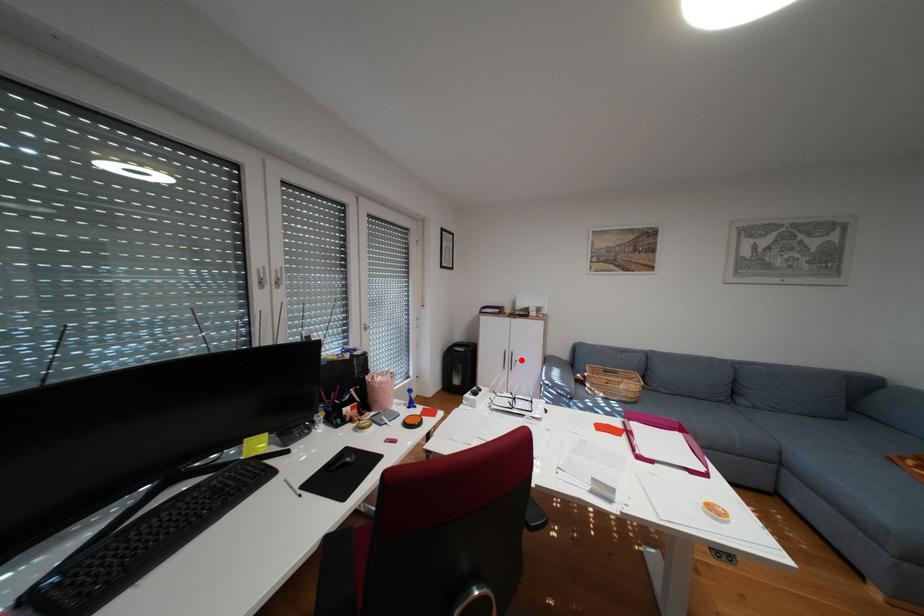
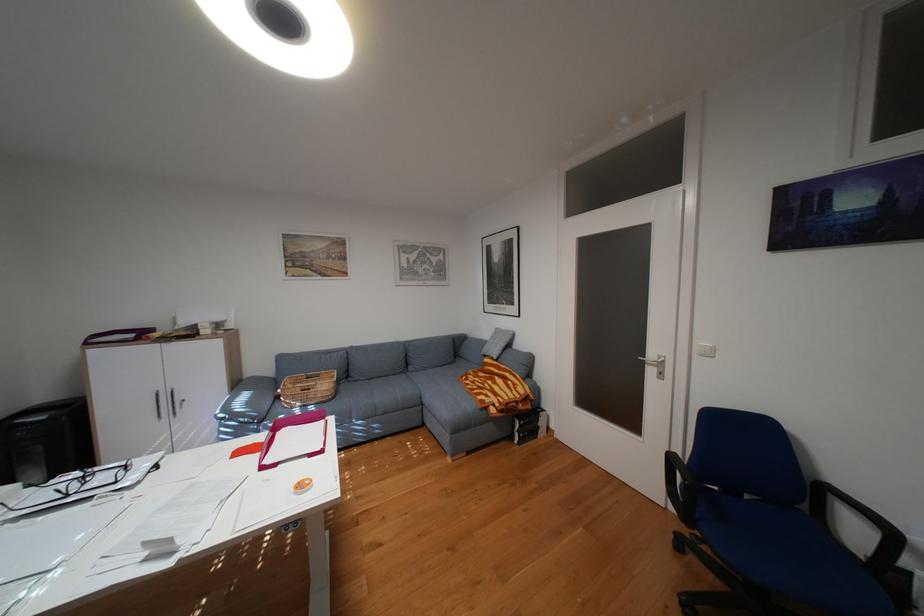
Locate, in the second image, the point that corresponds to the highlighted location in the first image.

(180, 403)